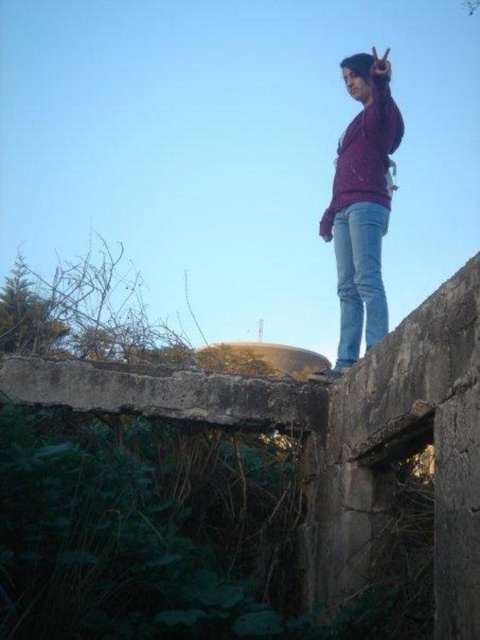
Does purple matte sweater at upper center lie in front of matte purple sweatshirt at center?

No, purple matte sweater at upper center is further to the viewer.

Which is above, purple matte sweater at upper center or matte purple sweatshirt at center?

matte purple sweatshirt at center is higher up.

Is point (352, 134) farther from viewer compared to point (359, 147)?

Yes, point (352, 134) is farther from viewer.

At what (x,y) coordinates should I click in order to perform the action: click on purple matte sweater at upper center. Please return your answer as a coordinate pair (x, y). The width and height of the screenshot is (480, 640). Looking at the image, I should click on (361, 204).

Does concrete at upper center have a greater height compared to jeans at upper right?

Indeed, concrete at upper center has a greater height compared to jeans at upper right.

Which is behind, point (109, 397) or point (343, 296)?

The point (343, 296) is more distant.

The width and height of the screenshot is (480, 640). I want to click on concrete at upper center, so click(400, 433).

Is concrete at upper center wider than purple matte sweater at upper center?

Correct, the width of concrete at upper center exceeds that of purple matte sweater at upper center.

Does concrete at upper center have a larger size compared to purple matte sweater at upper center?

Yes.

The width and height of the screenshot is (480, 640). I want to click on concrete at upper center, so click(x=400, y=433).